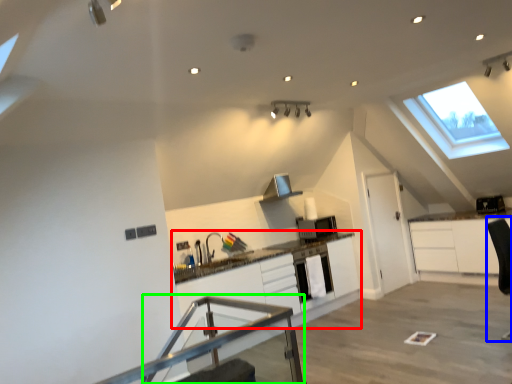
Question: Considering the real-world distances, which object is farthest from cabinetry (highlighted by a red box)? swivel chair (highlighted by a blue box) or table (highlighted by a green box)?

Choices:
 (A) swivel chair
 (B) table

Answer: (A)